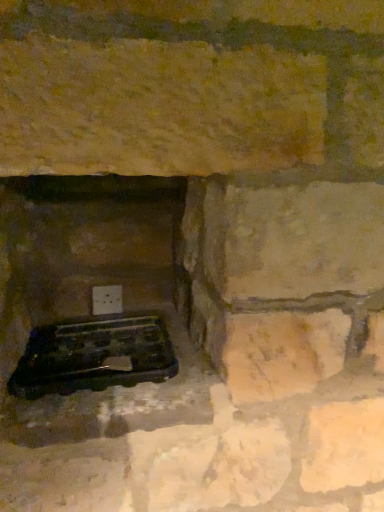
Question: Considering the relative positions of white plastic electric outlet at lower center and black plastic tray at lower left in the image provided, is white plastic electric outlet at lower center to the left of black plastic tray at lower left from the viewer's perspective?

Choices:
 (A) yes
 (B) no

Answer: (A)

Question: From the image's perspective, is white plastic electric outlet at lower center located beneath black plastic tray at lower left?

Choices:
 (A) yes
 (B) no

Answer: (B)

Question: Does white plastic electric outlet at lower center have a lesser height compared to black plastic tray at lower left?

Choices:
 (A) yes
 (B) no

Answer: (A)

Question: Could you tell me if white plastic electric outlet at lower center is facing black plastic tray at lower left?

Choices:
 (A) yes
 (B) no

Answer: (A)

Question: Is white plastic electric outlet at lower center looking in the opposite direction of black plastic tray at lower left?

Choices:
 (A) no
 (B) yes

Answer: (A)

Question: From a real-world perspective, is black plastic tray at lower left above or below white plastic electric outlet at lower center?

Choices:
 (A) below
 (B) above

Answer: (A)

Question: Is black plastic tray at lower left in front of or behind white plastic electric outlet at lower center in the image?

Choices:
 (A) front
 (B) behind

Answer: (A)

Question: From the image's perspective, is black plastic tray at lower left located above or below white plastic electric outlet at lower center?

Choices:
 (A) below
 (B) above

Answer: (A)

Question: Considering the positions of black plastic tray at lower left and white plastic electric outlet at lower center in the image, is black plastic tray at lower left wider or thinner than white plastic electric outlet at lower center?

Choices:
 (A) thin
 (B) wide

Answer: (B)

Question: From a real-world perspective, relative to black plastic grill at lower left, is white plastic electric outlet at lower center vertically above or below?

Choices:
 (A) below
 (B) above

Answer: (B)

Question: Is point (97, 307) closer or farther from the camera than point (140, 373)?

Choices:
 (A) farther
 (B) closer

Answer: (A)

Question: Is white plastic electric outlet at lower center situated inside black plastic grill at lower left or outside?

Choices:
 (A) inside
 (B) outside

Answer: (B)

Question: Would you say white plastic electric outlet at lower center is to the left or to the right of black plastic grill at lower left in the picture?

Choices:
 (A) left
 (B) right

Answer: (A)

Question: From a real-world perspective, is black plastic grill at lower left physically located above or below white plastic electric outlet at lower center?

Choices:
 (A) below
 (B) above

Answer: (A)

Question: Considering the positions of point (105, 364) and point (117, 285), is point (105, 364) closer or farther from the camera than point (117, 285)?

Choices:
 (A) farther
 (B) closer

Answer: (B)